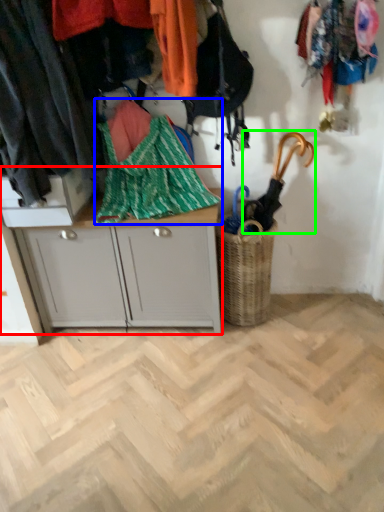
Question: Estimate the real-world distances between objects in this image. Which object is farther from desk (highlighted by a red box), blanket (highlighted by a blue box) or umbrella (highlighted by a green box)?

Choices:
 (A) blanket
 (B) umbrella

Answer: (B)